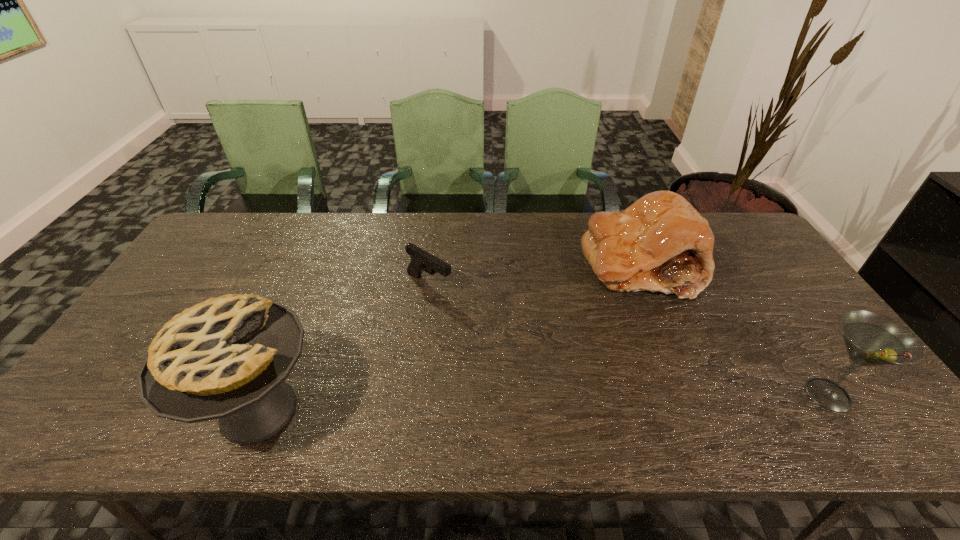
Image resolution: width=960 pixels, height=540 pixels. Identify the location of free space on the desktop that is between the leftmost object and the martini and is positioned on the front-facing side of the shortest object. (618, 401).

At what (x,y) coordinates should I click in order to perform the action: click on vacant spot on the desktop that is between the pie and the martini and is positioned on the filling side of the bread. Please return your answer as a coordinate pair (x, y). The image size is (960, 540). Looking at the image, I should click on (555, 402).